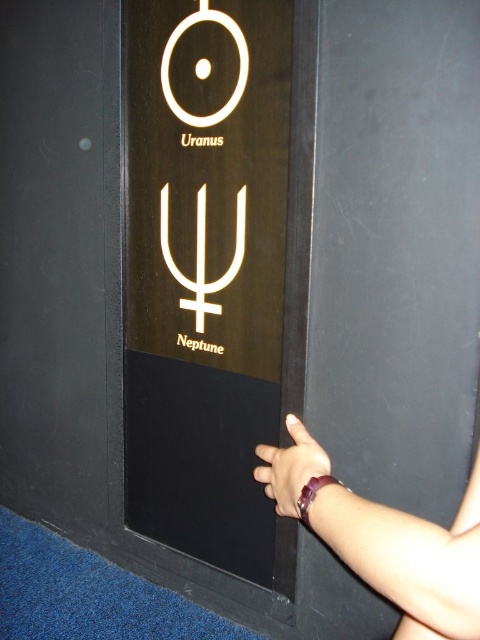
Question: Which point is closer to the camera?

Choices:
 (A) tap(231, 264)
 (B) tap(184, 113)
 (C) tap(288, 467)

Answer: (C)

Question: Considering the real-world distances, which object is closest to the purple fabric wristband at lower center?

Choices:
 (A) white glossy trident at center
 (B) white circle at upper left

Answer: (A)

Question: Is white glossy trident at center below white circle at upper left?

Choices:
 (A) yes
 (B) no

Answer: (A)

Question: Considering the relative positions of white glossy trident at center and purple fabric wristband at lower center in the image provided, where is white glossy trident at center located with respect to purple fabric wristband at lower center?

Choices:
 (A) above
 (B) below

Answer: (A)

Question: Which object is the closest to the white glossy trident at center?

Choices:
 (A) white circle at upper left
 (B) purple fabric wristband at lower center

Answer: (A)

Question: Can you confirm if white glossy trident at center is positioned above white circle at upper left?

Choices:
 (A) yes
 (B) no

Answer: (B)